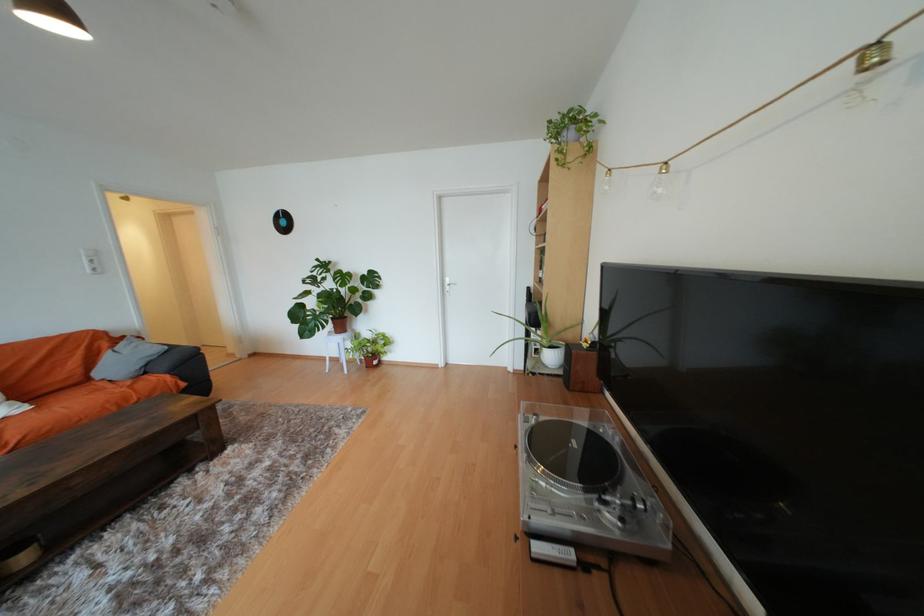
Where would you lift the turntable tonearm? Please return your answer as a coordinate pair (x, y).

(630, 524)